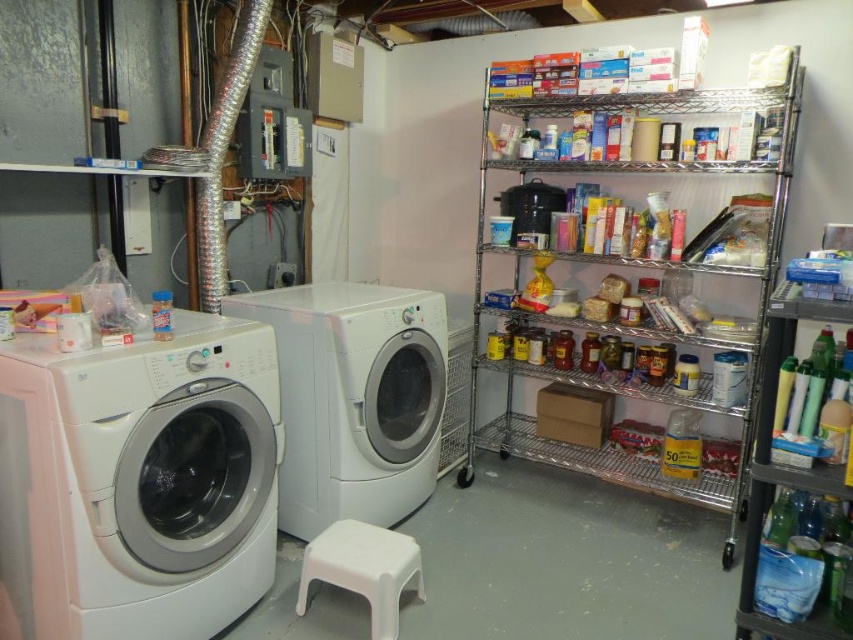
Question: Estimate the real-world distances between objects in this image. Which object is closer to the clear plastic bottles at right?

Choices:
 (A) metallic wire shelving at right
 (B) white glossy washing machine at left
 (C) white glossy washing machine at center

Answer: (A)

Question: Where is white glossy washing machine at left located in relation to white plastic stool at lower center in the image?

Choices:
 (A) above
 (B) below

Answer: (A)

Question: Is metallic wire shelving at right further to the viewer compared to clear plastic bottles at right?

Choices:
 (A) no
 (B) yes

Answer: (B)

Question: Which point is farther to the camera?

Choices:
 (A) white glossy washing machine at left
 (B) white glossy washing machine at center
 (C) metallic wire shelving at right

Answer: (B)

Question: Which object appears farthest from the camera in this image?

Choices:
 (A) metallic wire shelving at right
 (B) white glossy washing machine at center

Answer: (B)

Question: Does white glossy washing machine at center have a larger size compared to white plastic stool at lower center?

Choices:
 (A) no
 (B) yes

Answer: (B)